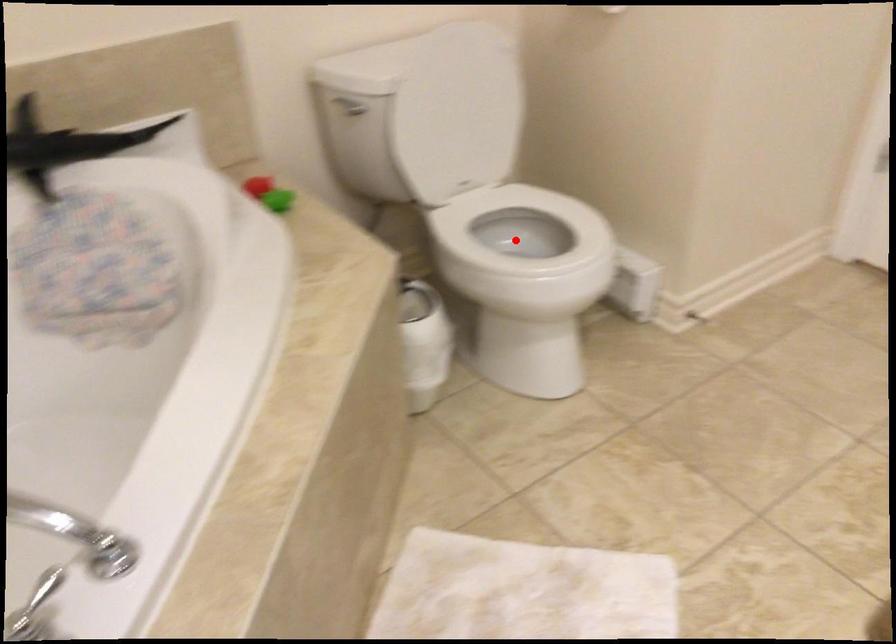
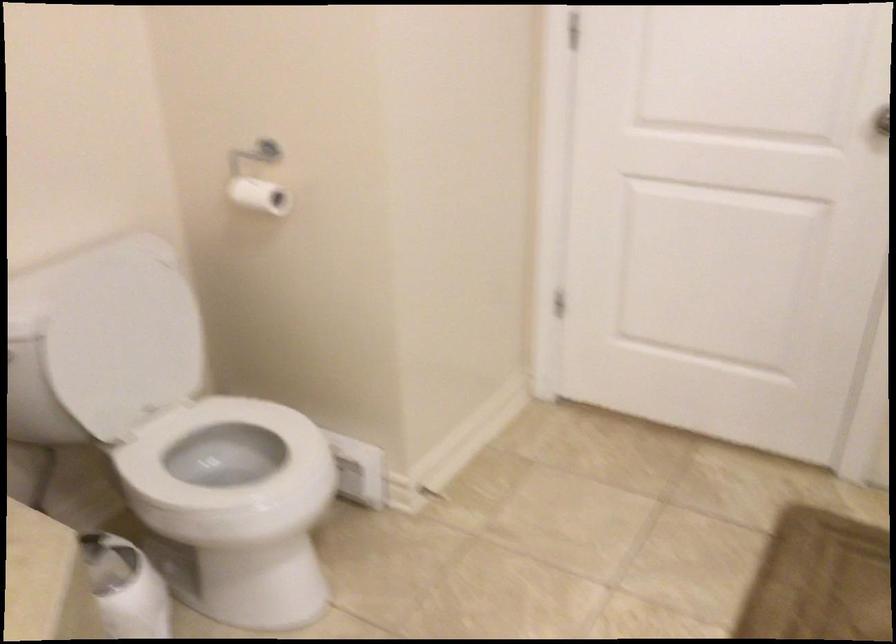
Question: A red point is marked in image1. In image2, is the corresponding 3D point closer to the camera or farther? Reply with the corresponding letter.

Choices:
 (A) The corresponding 3D point is closer.
 (B) The corresponding 3D point is farther.

Answer: (A)